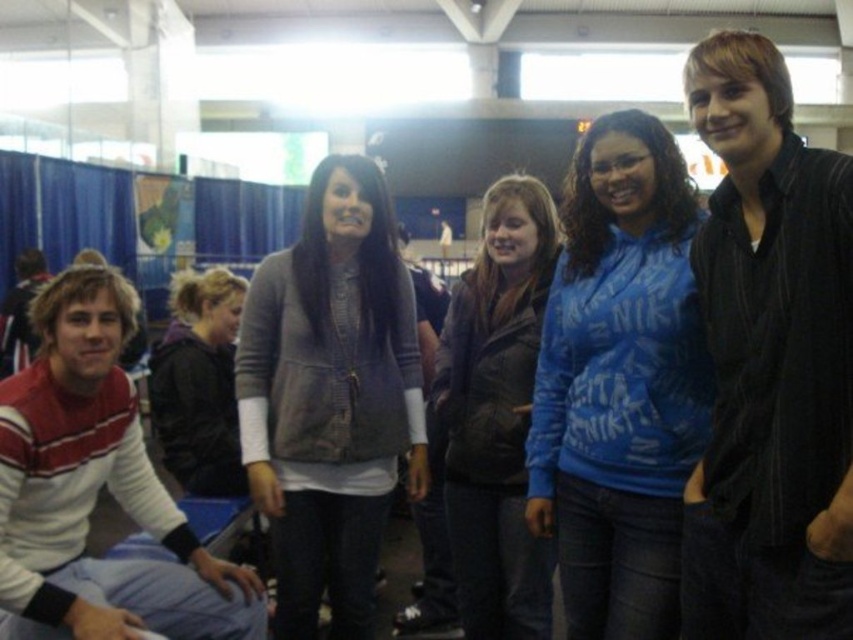
You are standing in the large hall and want to find the matte gray jacket at center. According to the coordinates provided, where should you look relative to the stage or display area?

The matte gray jacket at center is located at coordinates point [329,397]. Since the coordinates are relative to the image frame, you should look towards the center area of the image, slightly to the right and lower middle section to find the matte gray jacket at center.

You are at the event and want to take a photo of both the black velvet shirt at right and the matte gray jacket at center. Which one should you focus on first to ensure it is in the foreground?

The black velvet shirt at right has a lesser height compared to the matte gray jacket at center, so you should focus on the matte gray jacket at center first to ensure it is in the foreground.

You are standing in the large hall and want to hand a note to the person wearing the matte brown jacket at center without approaching the matte gray jacket at center. Is this possible based on their positions?

The matte gray jacket at center is closer to the viewer than the matte brown jacket at center, so you would have to pass the matte gray jacket at center to reach the matte brown jacket at center. Therefore, it is not possible to hand the note without approaching the matte gray jacket at center.